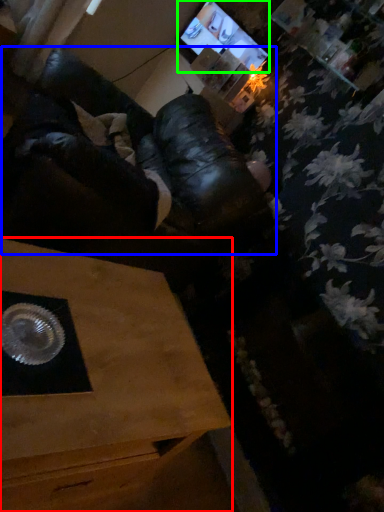
Question: Which object is positioned farthest from table (highlighted by a red box)? Select from squat (highlighted by a blue box) and computer monitor (highlighted by a green box).

Choices:
 (A) squat
 (B) computer monitor

Answer: (B)